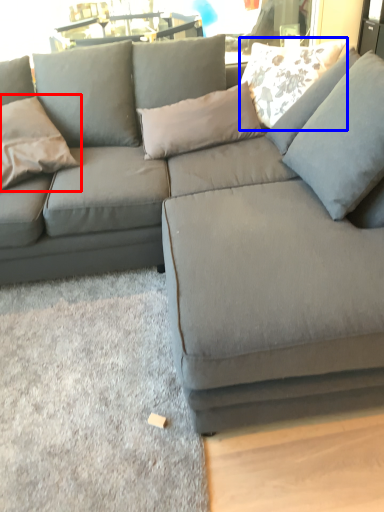
Question: Which of the following is the closest to the observer, pillow (highlighted by a red box) or pillow (highlighted by a blue box)?

Choices:
 (A) pillow
 (B) pillow

Answer: (A)